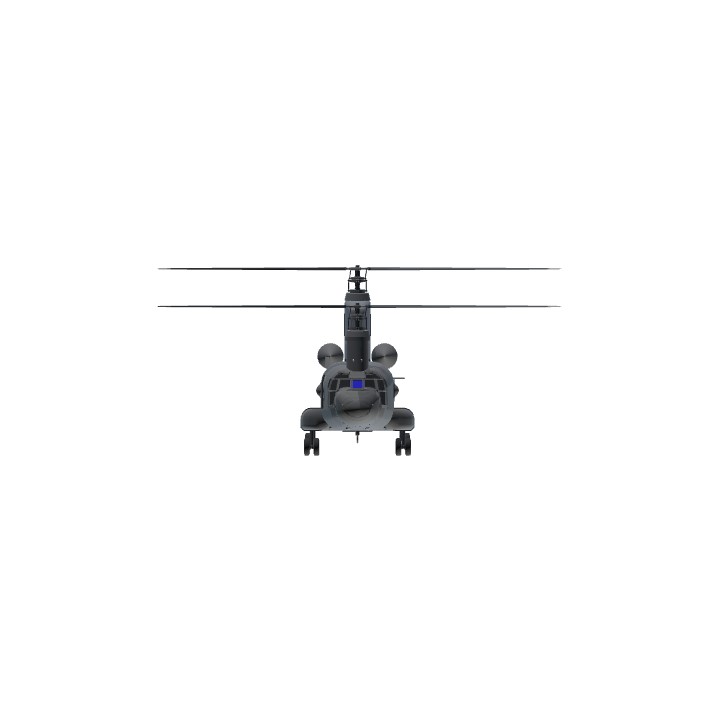
In order to click on windows in this screenshot , I will do `click(371, 379)`, `click(341, 379)`.